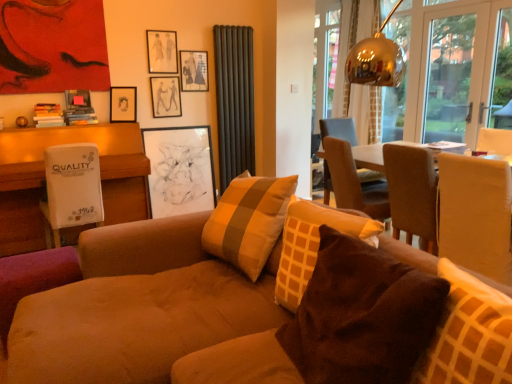
What do you see at coordinates (138, 307) in the screenshot? The height and width of the screenshot is (384, 512). I see `suede couch at center` at bounding box center [138, 307].

Where is `dark grey ribbed curtain at upper center, positioned as the 2th curtain in back-to-front order`? Image resolution: width=512 pixels, height=384 pixels. dark grey ribbed curtain at upper center, positioned as the 2th curtain in back-to-front order is located at coordinates (234, 101).

Describe the element at coordinates (369, 157) in the screenshot. I see `wooden table at center` at that location.

This screenshot has width=512, height=384. I want to click on suede couch at center, so click(x=138, y=307).

From a real-world perspective, count 1st curtains downward from the matte black picture frame at upper center, which appears as the 2th picture frame when viewed from the top, and point to it. Please provide its 2D coordinates.

[(364, 111)]

Is white sheer curtain at upper right, which is the first curtain in right-to-left order, facing towards matte black picture frame at upper center, which appears as the 2th picture frame when viewed from the top?

Yes, white sheer curtain at upper right, which is the first curtain in right-to-left order, faces towards matte black picture frame at upper center, which appears as the 2th picture frame when viewed from the top.

Does white sheer curtain at upper right, which is the second curtain from front to back, have a smaller size compared to matte black picture frame at upper center, the fourth picture frame in the bottom-to-top sequence?

Actually, white sheer curtain at upper right, which is the second curtain from front to back, might be larger than matte black picture frame at upper center, the fourth picture frame in the bottom-to-top sequence.

Does white sheer curtain at upper right, which is the first curtain in right-to-left order, have a lesser height compared to matte black picture frame at upper center, which appears as the 2th picture frame when viewed from the top?

No.

You are a GUI agent. You are given a task and a screenshot of the screen. Output one action in this format:
    pyautogui.click(x=<x>, y=<y>)
    Task: Click on the 1st picture frame behind the matte black picture frame at upper center, the 5th picture frame in the bottom-to-top sequence, counting from the anchor's position
    The width and height of the screenshot is (512, 384).
    Given the screenshot: What is the action you would take?
    pyautogui.click(x=180, y=170)

Is matte black picture frame at upper center, the 1th picture frame in the top-to-bottom sequence, far from black matte picture frame at center, the 5th picture frame in the top-to-bottom sequence?

Actually, matte black picture frame at upper center, the 1th picture frame in the top-to-bottom sequence, and black matte picture frame at center, the 5th picture frame in the top-to-bottom sequence, are a little close together.

Considering the sizes of objects matte black picture frame at upper center, the 1th picture frame in the top-to-bottom sequence, and black matte picture frame at center, which appears as the first picture frame when ordered from the bottom, in the image provided, who is thinner, matte black picture frame at upper center, the 1th picture frame in the top-to-bottom sequence, or black matte picture frame at center, which appears as the first picture frame when ordered from the bottom,?

Thinner between the two is matte black picture frame at upper center, the 1th picture frame in the top-to-bottom sequence.

How many degrees apart are the facing directions of matte black picture frame at upper center, the 1th picture frame in the top-to-bottom sequence, and black matte picture frame at center, the 5th picture frame in the top-to-bottom sequence?

The angular difference between matte black picture frame at upper center, the 1th picture frame in the top-to-bottom sequence, and black matte picture frame at center, the 5th picture frame in the top-to-bottom sequence, is 0.834 degrees.

From the image's perspective, which object appears higher, wooden table at center or matte black picture frame at upper center, which is counted as the 3th picture frame, starting from the top?

matte black picture frame at upper center, which is counted as the 3th picture frame, starting from the top.

Find the location of a particular element. This screenshot has width=512, height=384. table on the right of matte black picture frame at upper center, the third picture frame ordered from the bottom is located at coordinates (369, 157).

Between wooden table at center and matte black picture frame at upper center, which is counted as the 3th picture frame, starting from the top, which one is positioned in front?

wooden table at center is closer to the camera.

Considering the relative sizes of wooden table at center and matte black picture frame at upper center, the third picture frame ordered from the bottom, in the image provided, is wooden table at center taller than matte black picture frame at upper center, the third picture frame ordered from the bottom,?

Yes.

Is wooden table at center taller than black matte picture frame at center, the 5th picture frame in the top-to-bottom sequence?

Incorrect, the height of wooden table at center is not larger of that of black matte picture frame at center, the 5th picture frame in the top-to-bottom sequence.

How many degrees apart are the facing directions of wooden table at center and black matte picture frame at center, which appears as the first picture frame when ordered from the bottom?

They differ by 92.5 degrees in their facing directions.

Is wooden table at center situated inside black matte picture frame at center, the 5th picture frame in the top-to-bottom sequence, or outside?

wooden table at center cannot be found inside black matte picture frame at center, the 5th picture frame in the top-to-bottom sequence.

Is wooden table at center facing away from black matte picture frame at center, which appears as the first picture frame when ordered from the bottom?

No, wooden table at center is not facing away from black matte picture frame at center, which appears as the first picture frame when ordered from the bottom.

Is matte black picture frame at upper left, which is counted as the 4th picture frame, starting from the top, looking in the opposite direction of suede couch at center?

No, matte black picture frame at upper left, which is counted as the 4th picture frame, starting from the top, is not facing the opposite direction of suede couch at center.

Which object is closer to the camera, matte black picture frame at upper left, acting as the second picture frame starting from the bottom, or suede couch at center?

Positioned in front is suede couch at center.

Choose the correct answer: Is black matte picture frame at center, which appears as the first picture frame when ordered from the bottom, inside wooden table at center or outside it?

black matte picture frame at center, which appears as the first picture frame when ordered from the bottom, is located beyond the bounds of wooden table at center.

Where is `table on the right side of black matte picture frame at center, which appears as the first picture frame when ordered from the bottom`? The image size is (512, 384). table on the right side of black matte picture frame at center, which appears as the first picture frame when ordered from the bottom is located at coordinates (369, 157).

How many degrees apart are the facing directions of black matte picture frame at center, the 5th picture frame in the top-to-bottom sequence, and wooden table at center?

The facing directions of black matte picture frame at center, the 5th picture frame in the top-to-bottom sequence, and wooden table at center are 92.5 degrees apart.

Is black matte picture frame at center, which appears as the first picture frame when ordered from the bottom, to the left or to the right of wooden table at center in the image?

Clearly, black matte picture frame at center, which appears as the first picture frame when ordered from the bottom, is on the left of wooden table at center in the image.

There is a matte brown chair at right, the 2th chair from the back. At what (x,y) coordinates should I click in order to perform the action: click on the 2nd curtain above it (from the image's perspective). Please return your answer as a coordinate pair (x, y). Looking at the image, I should click on (364, 111).

Does white sheer curtain at upper right, the 1th curtain in the back-to-front sequence, have a lesser height compared to matte brown chair at right, the 1th chair viewed from the front?

No, white sheer curtain at upper right, the 1th curtain in the back-to-front sequence, is not shorter than matte brown chair at right, the 1th chair viewed from the front.

Which of these two, white sheer curtain at upper right, the second curtain viewed from the left, or matte brown chair at right, the 2th chair from the back, is thinner?

Thinner between the two is white sheer curtain at upper right, the second curtain viewed from the left.

Are white sheer curtain at upper right, the 1th curtain in the back-to-front sequence, and matte brown chair at right, the 1th chair viewed from the front, located far from each other?

Yes, white sheer curtain at upper right, the 1th curtain in the back-to-front sequence, is far from matte brown chair at right, the 1th chair viewed from the front.

At what (x,y) coordinates should I click in order to perform the action: click on curtain that is above the matte black picture frame at upper center, the fourth picture frame in the bottom-to-top sequence (from the image's perspective). Please return your answer as a coordinate pair (x, y). The width and height of the screenshot is (512, 384). Looking at the image, I should click on (364, 111).

Locate an element on the screen. Image resolution: width=512 pixels, height=384 pixels. the 1st picture frame in front of the black matte picture frame at center, the 5th picture frame in the top-to-bottom sequence is located at coordinates (162, 51).

Which object lies further to the anchor point matte black picture frame at upper left, acting as the second picture frame starting from the bottom, brown fabric pillow at lower right, the 2th pillow when ordered from left to right, or matte black picture frame at upper center, which appears as the 2th picture frame when viewed from the top?

The object further to matte black picture frame at upper left, acting as the second picture frame starting from the bottom, is brown fabric pillow at lower right, the 2th pillow when ordered from left to right.

Estimate the real-world distances between objects in this image. Which object is closer to matte black picture frame at upper center, the 5th picture frame in the bottom-to-top sequence, brown fabric pillow at lower right, the 2th pillow when ordered from left to right, or black matte picture frame at center, the 5th picture frame in the top-to-bottom sequence?

The object closer to matte black picture frame at upper center, the 5th picture frame in the bottom-to-top sequence, is black matte picture frame at center, the 5th picture frame in the top-to-bottom sequence.

Looking at the image, which one is located closer to matte black picture frame at upper center, the 1th picture frame in the top-to-bottom sequence, black matte picture frame at center, the 5th picture frame in the top-to-bottom sequence, or matte black picture frame at upper left, acting as the second picture frame starting from the bottom?

The object closer to matte black picture frame at upper center, the 1th picture frame in the top-to-bottom sequence, is matte black picture frame at upper left, acting as the second picture frame starting from the bottom.

Which object lies further to the anchor point matte black picture frame at upper center, the third picture frame ordered from the bottom, matte black picture frame at upper center, the fourth picture frame in the bottom-to-top sequence, or matte black picture frame at upper center, the 1th picture frame in the top-to-bottom sequence?

Based on the image, matte black picture frame at upper center, the 1th picture frame in the top-to-bottom sequence, appears to be further to matte black picture frame at upper center, the third picture frame ordered from the bottom.

From the image, which object appears to be farther from brown fabric pillow at lower right, the 2th pillow when ordered from left to right, brown fabric chair at upper right, the 2th chair when ordered from front to back, or matte brown chair at right, the 2th chair from the back?

Based on the image, brown fabric chair at upper right, the 2th chair when ordered from front to back, appears to be further to brown fabric pillow at lower right, the 2th pillow when ordered from left to right.

Based on their spatial positions, is brown fabric pillow at lower right, the 2th pillow when ordered from left to right, or matte black picture frame at upper center, the fourth picture frame in the bottom-to-top sequence, closer to dark grey ribbed curtain at upper center, positioned as the 2th curtain in back-to-front order?

matte black picture frame at upper center, the fourth picture frame in the bottom-to-top sequence, lies closer to dark grey ribbed curtain at upper center, positioned as the 2th curtain in back-to-front order, than the other object.

Looking at the image, which one is located further to dark grey ribbed curtain at upper center, which is the first curtain from left to right, transparent glass door at upper right or brown fabric chair at upper right, the 1th chair when ordered from back to front?

transparent glass door at upper right lies further to dark grey ribbed curtain at upper center, which is the first curtain from left to right, than the other object.

Considering their positions, is wooden table at center positioned closer to white cardboard box at left than matte black picture frame at upper center, which appears as the 2th picture frame when viewed from the top?

Among the two, matte black picture frame at upper center, which appears as the 2th picture frame when viewed from the top, is located nearer to white cardboard box at left.

The height and width of the screenshot is (384, 512). What are the coordinates of `picture frame between black matte picture frame at center, the 5th picture frame in the top-to-bottom sequence, and matte brown chair at right, the 1th chair viewed from the front, in the horizontal direction` in the screenshot? It's located at (194, 70).

Image resolution: width=512 pixels, height=384 pixels. What are the coordinates of `curtain between matte black picture frame at upper center, the fourth picture frame in the bottom-to-top sequence, and white sheer curtain at upper right, which is the first curtain in right-to-left order, from left to right` in the screenshot? It's located at (234, 101).

Where is `curtain between matte black picture frame at upper center, the 1th picture frame in the top-to-bottom sequence, and brown fabric chair at upper right, the 2th chair when ordered from front to back, in the horizontal direction`? The height and width of the screenshot is (384, 512). curtain between matte black picture frame at upper center, the 1th picture frame in the top-to-bottom sequence, and brown fabric chair at upper right, the 2th chair when ordered from front to back, in the horizontal direction is located at coordinates (234, 101).

Locate an element on the screen. The image size is (512, 384). table between suede couch at center and white sheer curtain at upper right, the second curtain viewed from the left, along the z-axis is located at coordinates (369, 157).